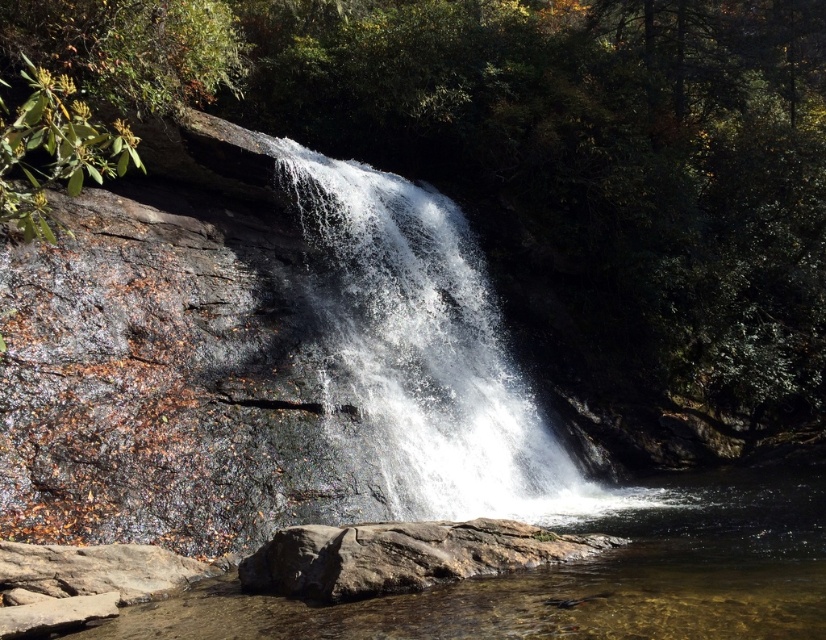
Question: Which is nearer to the white frothy water at center?

Choices:
 (A) clear water at center
 (B) brown rough rock at lower center

Answer: (A)

Question: Observing the image, what is the correct spatial positioning of clear water at center in reference to brown rough rock at lower center?

Choices:
 (A) below
 (B) above

Answer: (A)

Question: Based on their relative distances, which object is farther from the clear water at center?

Choices:
 (A) white frothy water at center
 (B) brown rough rock at lower center

Answer: (A)

Question: Which of these objects is positioned farthest from the brown rough rock at lower center?

Choices:
 (A) clear water at center
 (B) white frothy water at center

Answer: (B)

Question: Is white frothy water at center positioned in front of brown rough rock at lower center?

Choices:
 (A) no
 (B) yes

Answer: (A)

Question: Is white frothy water at center positioned in front of brown rough rock at lower center?

Choices:
 (A) no
 (B) yes

Answer: (A)